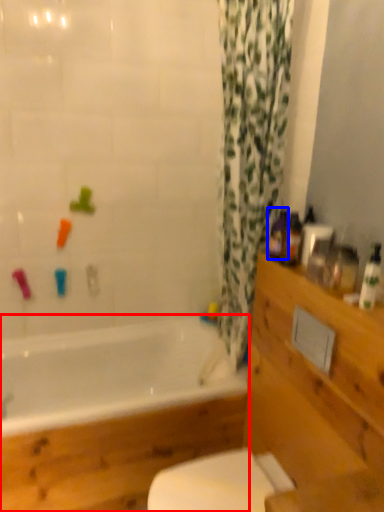
Question: Which of the following is the farthest to the observer, bathtub (highlighted by a red box) or toiletry (highlighted by a blue box)?

Choices:
 (A) bathtub
 (B) toiletry

Answer: (B)